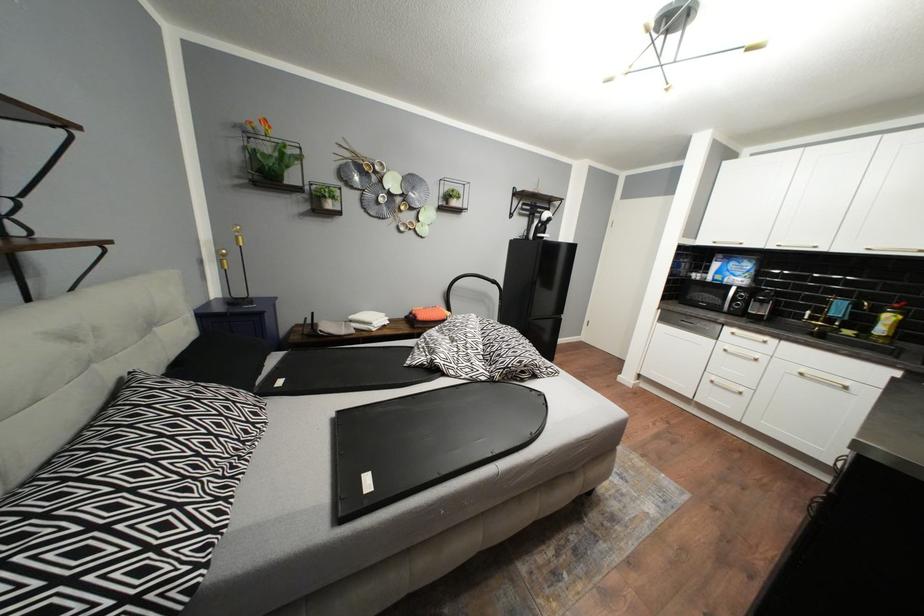
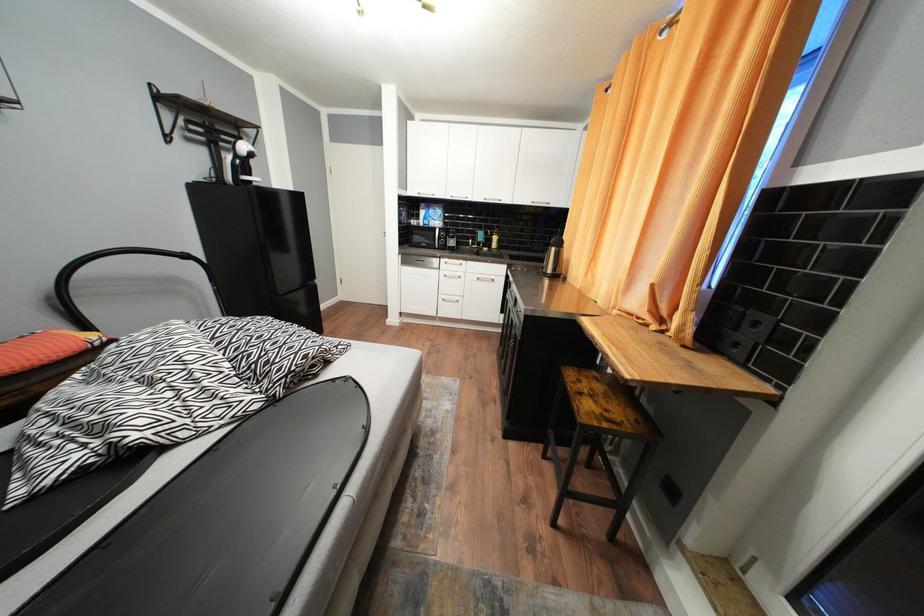
Based on the continuous images, in which direction is the camera rotating?

The rotation direction of the camera is right-down.